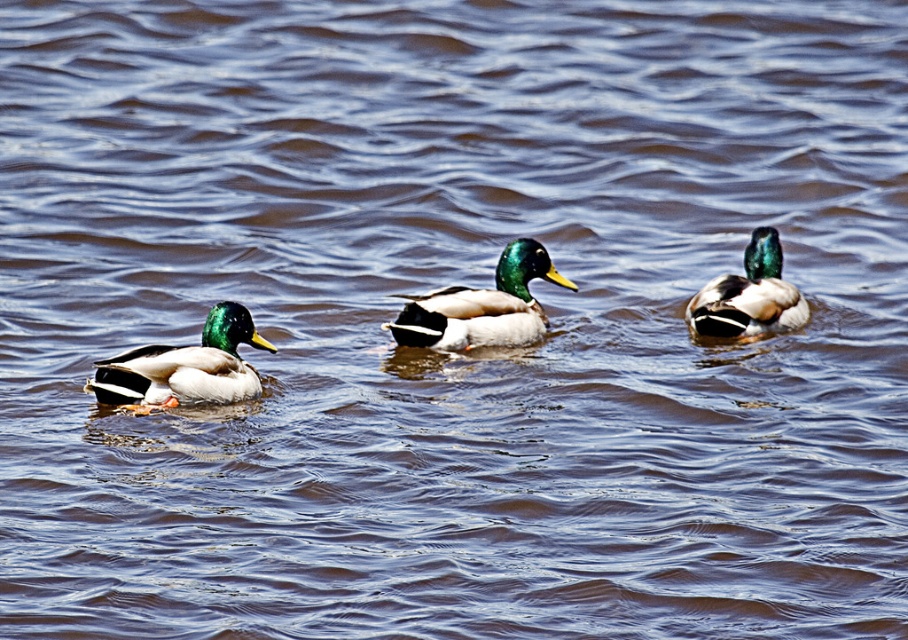
Question: Is green glossy duck at center closer to the viewer compared to shiny green head at right?

Choices:
 (A) yes
 (B) no

Answer: (A)

Question: Which point is farther from the camera taking this photo?

Choices:
 (A) [x=785, y=308]
 (B) [x=245, y=323]
 (C) [x=413, y=307]

Answer: (A)

Question: Based on their relative distances, which object is farther from the green glossy duck at center?

Choices:
 (A) shiny green head at right
 (B) shiny green drake at left

Answer: (B)

Question: Is the position of shiny green drake at left more distant than that of green glossy duck at center?

Choices:
 (A) no
 (B) yes

Answer: (A)

Question: Which of these objects is positioned farthest from the shiny green head at right?

Choices:
 (A) green glossy duck at center
 (B) shiny green drake at left

Answer: (B)

Question: Is shiny green drake at left wider than green glossy duck at center?

Choices:
 (A) no
 (B) yes

Answer: (A)